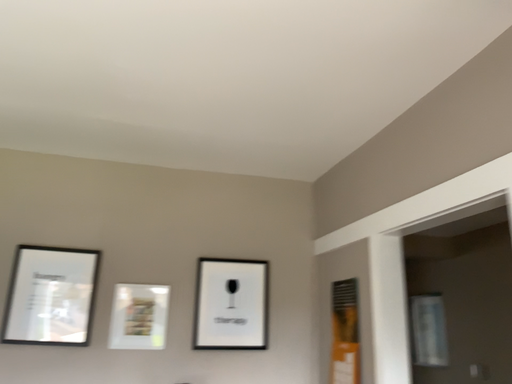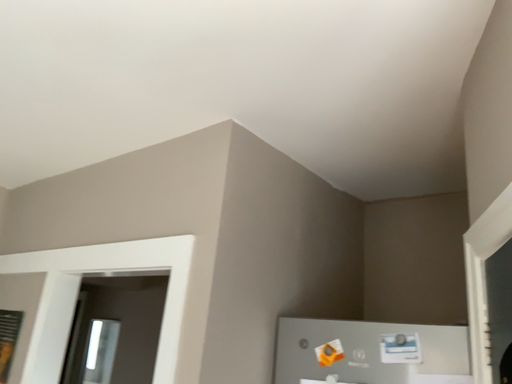
Question: Which way did the camera rotate in the video?

Choices:
 (A) rotated left
 (B) rotated right

Answer: (B)